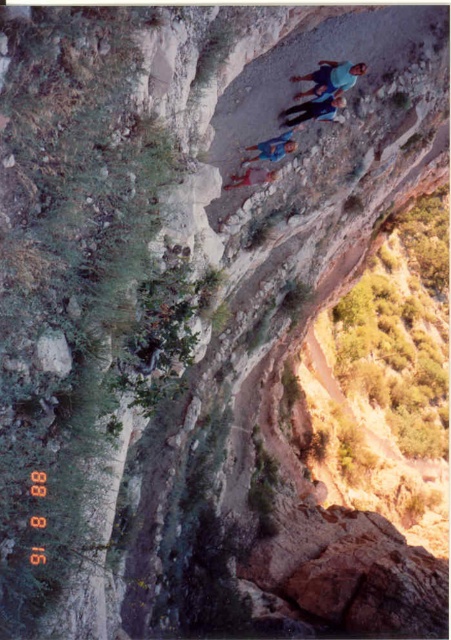
Looking at this image, you are a hiker who has just reached the edge of the canyon and sees the blue fabric shirt at upper center and the blue denim jeans at center. Which item is closer to you?

The blue fabric shirt at upper center is closer to you because it is in front of the blue denim jeans at center.

You are standing at the point labeled point (x=268, y=173) and want to walk to the point labeled point (x=343, y=77). Given that the path between them is steep and rocky, will you have to go uphill or downhill?

Since point (x=343, y=77) is closer to the camera than point (x=268, y=173), this means that point (x=343, y=77) is physically lower in elevation. Therefore, walking from point (x=268, y=173) to point (x=343, y=77) would require going downhill.